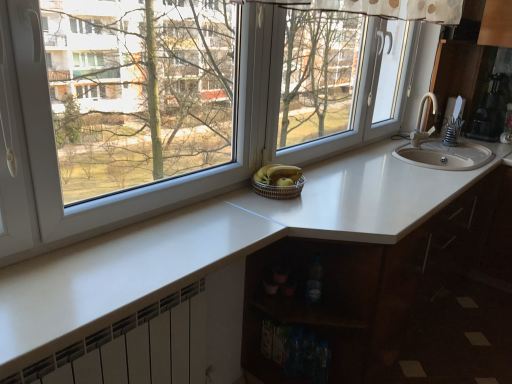
Image resolution: width=512 pixels, height=384 pixels. What do you see at coordinates (277, 174) in the screenshot?
I see `yellow matte bananas at center` at bounding box center [277, 174].

Locate an element on the screen. white glossy countertop at center is located at coordinates (399, 295).

This screenshot has width=512, height=384. Describe the element at coordinates (186, 174) in the screenshot. I see `transparent glass window at center` at that location.

Where is `metallic silver coffee maker at upper right`? metallic silver coffee maker at upper right is located at coordinates (490, 111).

What are the coordinates of `white metallic radiator at lower left` in the screenshot? It's located at (134, 348).

Considering the sizes of metallic silver coffee maker at upper right and white glossy countertop at center in the image, is metallic silver coffee maker at upper right wider or thinner than white glossy countertop at center?

Considering their sizes, metallic silver coffee maker at upper right looks slimmer than white glossy countertop at center.

Between metallic silver coffee maker at upper right and white glossy countertop at center, which one appears on the right side from the viewer's perspective?

From the viewer's perspective, metallic silver coffee maker at upper right appears more on the right side.

Are metallic silver coffee maker at upper right and white glossy countertop at center making contact?

No, metallic silver coffee maker at upper right is not making contact with white glossy countertop at center.

Between metallic silver coffee maker at upper right and white glossy countertop at center, which one is positioned in front?

white glossy countertop at center is closer to the camera.

Which is behind, transparent glass window at center or white glossy countertop at center?

white glossy countertop at center is behind.

Between point (372, 41) and point (476, 249), which one is positioned behind?

Positioned behind is point (476, 249).

Is transparent glass window at center wider or thinner than white glossy countertop at center?

In the image, transparent glass window at center appears to be more narrow than white glossy countertop at center.

Looking at this image, from a real-world perspective, is transparent glass window at center located higher than white glossy countertop at center?

Yes, from a real-world perspective, transparent glass window at center is on top of white glossy countertop at center.

Between point (291, 188) and point (277, 175), which one is positioned in front?

Positioned in front is point (291, 188).

From a real-world perspective, which object rests below the other?

woven brown basket at center, from a real-world perspective.

Considering the sizes of woven brown basket at center and yellow matte bananas at center in the image, is woven brown basket at center bigger or smaller than yellow matte bananas at center?

woven brown basket at center is bigger than yellow matte bananas at center.

Does white metallic radiator at lower left have a lesser width compared to yellow matte bananas at center?

Indeed, white metallic radiator at lower left has a lesser width compared to yellow matte bananas at center.

Is white metallic radiator at lower left smaller than yellow matte bananas at center?

Incorrect, white metallic radiator at lower left is not smaller in size than yellow matte bananas at center.

How far apart are white metallic radiator at lower left and yellow matte bananas at center?

The distance of white metallic radiator at lower left from yellow matte bananas at center is 29.22 inches.

Considering the relative positions of white metallic radiator at lower left and yellow matte bananas at center in the image provided, is white metallic radiator at lower left to the right of yellow matte bananas at center from the viewer's perspective?

In fact, white metallic radiator at lower left is to the left of yellow matte bananas at center.

Between translucent plastic bottle at lower center and transparent glass window at center, which one has smaller size?

translucent plastic bottle at lower center is smaller.

From a real-world perspective, which is physically below, translucent plastic bottle at lower center or transparent glass window at center?

translucent plastic bottle at lower center.

How different are the orientations of translucent plastic bottle at lower center and transparent glass window at center in degrees?

They differ by 90.5 degrees in their facing directions.

Can you confirm if translucent plastic bottle at lower center is positioned to the left of transparent glass window at center?

No, translucent plastic bottle at lower center is not to the left of transparent glass window at center.

Would you say white glossy countertop at center is to the left or to the right of yellow matte bananas at center in the picture?

white glossy countertop at center is to the right of yellow matte bananas at center.

Is white glossy countertop at center next to yellow matte bananas at center?

No, white glossy countertop at center is not next to yellow matte bananas at center.

Locate an element on the screen. The height and width of the screenshot is (384, 512). banana above the white glossy countertop at center (from a real-world perspective) is located at coordinates (277, 174).

How much distance is there between white glossy countertop at center and yellow matte bananas at center?

They are 36.44 inches apart.

Could you tell me if metallic silver coffee maker at upper right is facing transparent glass window at center?

Yes, metallic silver coffee maker at upper right faces towards transparent glass window at center.

Considering the relative sizes of metallic silver coffee maker at upper right and transparent glass window at center in the image provided, is metallic silver coffee maker at upper right bigger than transparent glass window at center?

No.

Does point (506, 84) appear closer or farther from the camera than point (21, 245)?

Point (506, 84) is positioned farther from the camera compared to point (21, 245).

Is the depth of metallic silver coffee maker at upper right greater than that of transparent glass window at center?

Yes.

The width and height of the screenshot is (512, 384). In order to click on cabinetry on the left of metallic silver coffee maker at upper right in this screenshot , I will do `click(399, 295)`.

Where is `window located above the white glossy countertop at center (from the image's perspective)`? Image resolution: width=512 pixels, height=384 pixels. window located above the white glossy countertop at center (from the image's perspective) is located at coordinates (186, 174).

Which object lies nearer to the anchor point transparent glass window at center, yellow matte bananas at center or metallic silver coffee maker at upper right?

The object closer to transparent glass window at center is yellow matte bananas at center.

Based on their spatial positions, is woven brown basket at center or yellow matte bananas at center further from white metallic radiator at lower left?

yellow matte bananas at center is positioned further to the anchor white metallic radiator at lower left.

Which object lies nearer to the anchor point white glossy countertop at center, white metallic radiator at lower left or woven brown basket at center?

white metallic radiator at lower left lies closer to white glossy countertop at center than the other object.

When comparing their distances from metallic silver coffee maker at upper right, does white metallic radiator at lower left or white glossy countertop at center seem further?

white metallic radiator at lower left lies further to metallic silver coffee maker at upper right than the other object.

Based on their spatial positions, is woven brown basket at center or transparent glass window at center further from translucent plastic bottle at lower center?

Based on the image, transparent glass window at center appears to be further to translucent plastic bottle at lower center.

Looking at the image, which one is located closer to yellow matte bananas at center, translucent plastic bottle at lower center or metallic silver coffee maker at upper right?

translucent plastic bottle at lower center is positioned closer to the anchor yellow matte bananas at center.

From the image, which object appears to be farther from white metallic radiator at lower left, yellow matte bananas at center or woven brown basket at center?

The object further to white metallic radiator at lower left is yellow matte bananas at center.

When comparing their distances from translucent plastic bottle at lower center, does yellow matte bananas at center or transparent glass window at center seem further?

Based on the image, transparent glass window at center appears to be further to translucent plastic bottle at lower center.

At what (x,y) coordinates should I click in order to perform the action: click on basket between yellow matte bananas at center and white glossy countertop at center. Please return your answer as a coordinate pair (x, y). The image size is (512, 384). Looking at the image, I should click on (279, 190).

Where is `bottle between transparent glass window at center and yellow matte bananas at center along the z-axis`? bottle between transparent glass window at center and yellow matte bananas at center along the z-axis is located at coordinates (314, 281).

I want to click on cabinetry located between white metallic radiator at lower left and metallic silver coffee maker at upper right in the left-right direction, so pyautogui.click(x=399, y=295).

Image resolution: width=512 pixels, height=384 pixels. What are the coordinates of `basket between yellow matte bananas at center and translucent plastic bottle at lower center in the up-down direction` in the screenshot? It's located at 279,190.